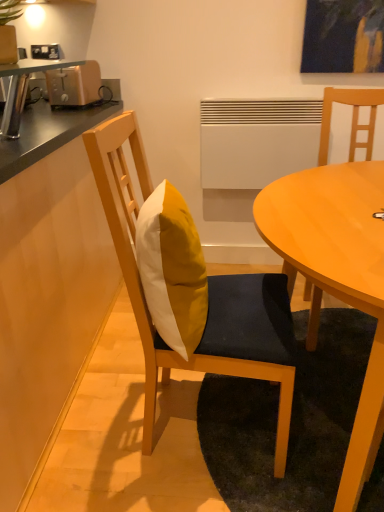
Where is `vacant space underneath yellow fabric cushion at center, which is the first chair from left to right (from a real-world perspective)`? The width and height of the screenshot is (384, 512). vacant space underneath yellow fabric cushion at center, which is the first chair from left to right (from a real-world perspective) is located at coordinates (189, 414).